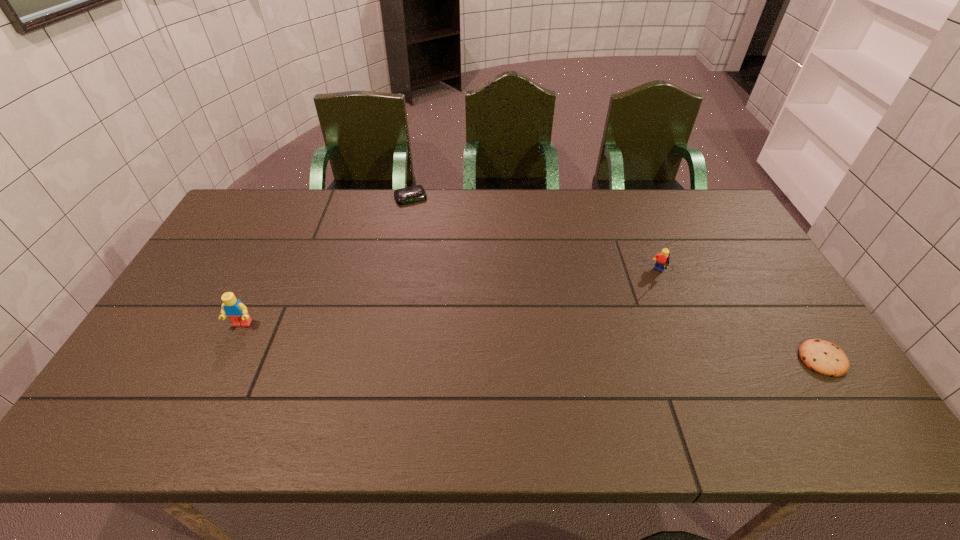
Locate an element on the screen. The image size is (960, 540). vacant space situated 0.300m on the display of the farthest object is located at coordinates (440, 259).

The width and height of the screenshot is (960, 540). Find the location of `free spot located on the display of the farthest object`. free spot located on the display of the farthest object is located at coordinates (425, 227).

Where is `free location located 0.210m on the display of the farthest object`? The height and width of the screenshot is (540, 960). free location located 0.210m on the display of the farthest object is located at coordinates (432, 241).

You are a GUI agent. You are given a task and a screenshot of the screen. Output one action in this format:
    pyautogui.click(x=<x>, y=<y>)
    Task: Click on the vacant region located on the front-facing side of the third nearest object
    
    Given the screenshot: What is the action you would take?
    pyautogui.click(x=650, y=292)

I want to click on free space located on the front-facing side of the third nearest object, so click(627, 327).

Identify the location of free space located on the front-facing side of the third nearest object. The image size is (960, 540). (625, 329).

You are a GUI agent. You are given a task and a screenshot of the screen. Output one action in this format:
    pyautogui.click(x=<x>, y=<y>)
    Task: Click on the object present at the far edge
    
    Given the screenshot: What is the action you would take?
    pyautogui.click(x=416, y=193)

Find the location of a particular element. object situated at the near edge is located at coordinates (825, 358).

At what (x,y) coordinates should I click in order to perform the action: click on object at the right edge. Please return your answer as a coordinate pair (x, y). Looking at the image, I should click on (825, 358).

Image resolution: width=960 pixels, height=540 pixels. I want to click on object at the near right corner, so click(825, 358).